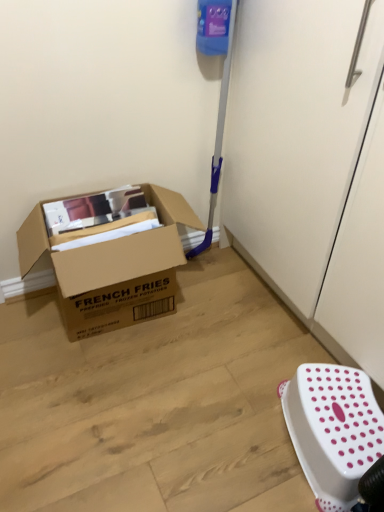
This screenshot has height=512, width=384. What do you see at coordinates (124, 272) in the screenshot?
I see `brown cardboard box at left` at bounding box center [124, 272].

Identify the location of brown cardboard box at left. [124, 272].

This screenshot has width=384, height=512. Describe the element at coordinates (333, 430) in the screenshot. I see `white plastic stool at lower right` at that location.

The height and width of the screenshot is (512, 384). Identify the location of white plastic stool at lower right. (333, 430).

Where is `brown cardboard box at left`? brown cardboard box at left is located at coordinates (124, 272).

Can you confirm if brown cardboard box at left is positioned to the left of white plastic stool at lower right?

Indeed, brown cardboard box at left is positioned on the left side of white plastic stool at lower right.

Is brown cardboard box at left behind white plastic stool at lower right?

Yes, it is behind white plastic stool at lower right.

Which point is more forward, (101, 316) or (356, 465)?

The point (356, 465) is in front.

From the image's perspective, is brown cardboard box at left located above or below white plastic stool at lower right?

brown cardboard box at left is above white plastic stool at lower right.

From a real-world perspective, is brown cardboard box at left positioned above or below white plastic stool at lower right?

brown cardboard box at left is above white plastic stool at lower right.

Is brown cardboard box at left thinner than white plastic stool at lower right?

No.

Can you confirm if brown cardboard box at left is taller than white plastic stool at lower right?

Yes, brown cardboard box at left is taller than white plastic stool at lower right.

Based on their sizes in the image, would you say brown cardboard box at left is bigger or smaller than white plastic stool at lower right?

Considering their sizes, brown cardboard box at left takes up more space than white plastic stool at lower right.

Is brown cardboard box at left located outside white plastic stool at lower right?

brown cardboard box at left lies outside white plastic stool at lower right's area.

Is brown cardboard box at left in contact with white plastic stool at lower right?

No, brown cardboard box at left is not touching white plastic stool at lower right.

Is brown cardboard box at left looking in the opposite direction of white plastic stool at lower right?

No, brown cardboard box at left is not facing away from white plastic stool at lower right.

Can you tell me how much brown cardboard box at left and white plastic stool at lower right differ in facing direction?

brown cardboard box at left and white plastic stool at lower right are facing 107 degrees away from each other.

The width and height of the screenshot is (384, 512). Find the location of `stool on the right side of brown cardboard box at left`. stool on the right side of brown cardboard box at left is located at coordinates (333, 430).

Which object is positioned more to the right, white plastic stool at lower right or brown cardboard box at left?

Positioned to the right is white plastic stool at lower right.

In the scene shown: Does white plastic stool at lower right come in front of brown cardboard box at left?

That is True.

Considering the positions of points (327, 441) and (164, 219), is point (327, 441) closer to camera compared to point (164, 219)?

That is True.

From the image's perspective, is white plastic stool at lower right located above or below brown cardboard box at left?

white plastic stool at lower right is below brown cardboard box at left.

From a real-world perspective, between white plastic stool at lower right and brown cardboard box at left, who is vertically lower?

white plastic stool at lower right is physically lower.

Consider the image. Considering the relative sizes of white plastic stool at lower right and brown cardboard box at left in the image provided, is white plastic stool at lower right thinner than brown cardboard box at left?

Correct, the width of white plastic stool at lower right is less than that of brown cardboard box at left.

Considering the relative sizes of white plastic stool at lower right and brown cardboard box at left in the image provided, is white plastic stool at lower right shorter than brown cardboard box at left?

Indeed, white plastic stool at lower right has a lesser height compared to brown cardboard box at left.

Who is bigger, white plastic stool at lower right or brown cardboard box at left?

brown cardboard box at left.

Is brown cardboard box at left located within white plastic stool at lower right?

That's incorrect, brown cardboard box at left is not inside white plastic stool at lower right.

Is white plastic stool at lower right not near brown cardboard box at left?

No, there isn't a large distance between white plastic stool at lower right and brown cardboard box at left.

Does white plastic stool at lower right turn towards brown cardboard box at left?

No, white plastic stool at lower right is not aimed at brown cardboard box at left.

What's the angular difference between white plastic stool at lower right and brown cardboard box at left's facing directions?

The angle between the facing direction of white plastic stool at lower right and the facing direction of brown cardboard box at left is 107 degrees.

This screenshot has height=512, width=384. Identify the location of stool on the right of the brown cardboard box at left. (333, 430).

Find the location of a particular element. box above the white plastic stool at lower right (from a real-world perspective) is located at coordinates (124, 272).

The image size is (384, 512). I want to click on stool to the right of brown cardboard box at left, so click(x=333, y=430).